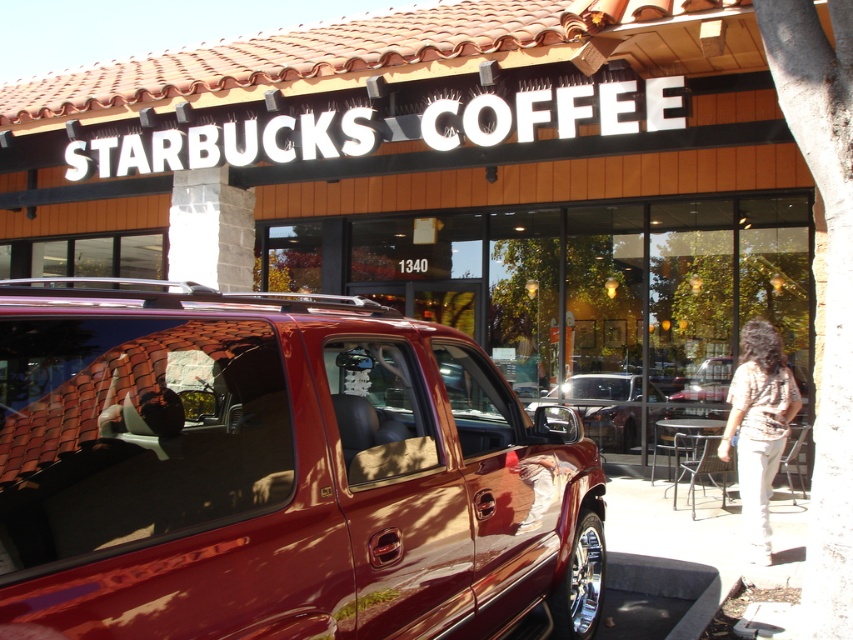
Question: Can you confirm if shiny metallic minivan at center is positioned above beige fabric shirt at lower right?

Choices:
 (A) no
 (B) yes

Answer: (B)

Question: Does matte black sign at center appear on the right side of shiny metallic car at center?

Choices:
 (A) no
 (B) yes

Answer: (B)

Question: Which object is the closest to the shiny metallic car at center?

Choices:
 (A) beige fabric shirt at lower right
 (B) matte black sign at center
 (C) shiny metallic minivan at center

Answer: (A)

Question: Which of the following is the farthest from the observer?

Choices:
 (A) shiny metallic car at center
 (B) shiny metallic minivan at center
 (C) matte black sign at center

Answer: (A)

Question: Does shiny metallic minivan at center appear under beige fabric shirt at lower right?

Choices:
 (A) yes
 (B) no

Answer: (B)

Question: Which of the following is the closest to the observer?

Choices:
 (A) (640, 374)
 (B) (183, 67)
 (C) (752, 458)
 (D) (306, 532)

Answer: (D)